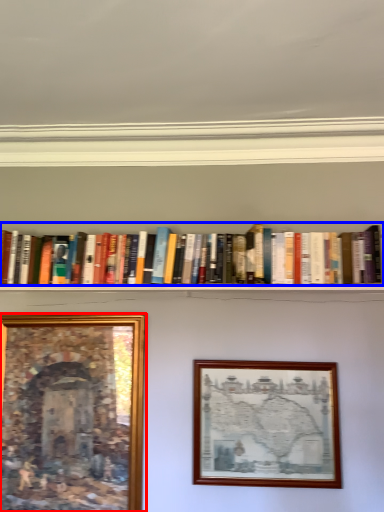
Question: Which point is closer to the camera, picture frame (highlighted by a red box) or book (highlighted by a blue box)?

Choices:
 (A) picture frame
 (B) book

Answer: (B)